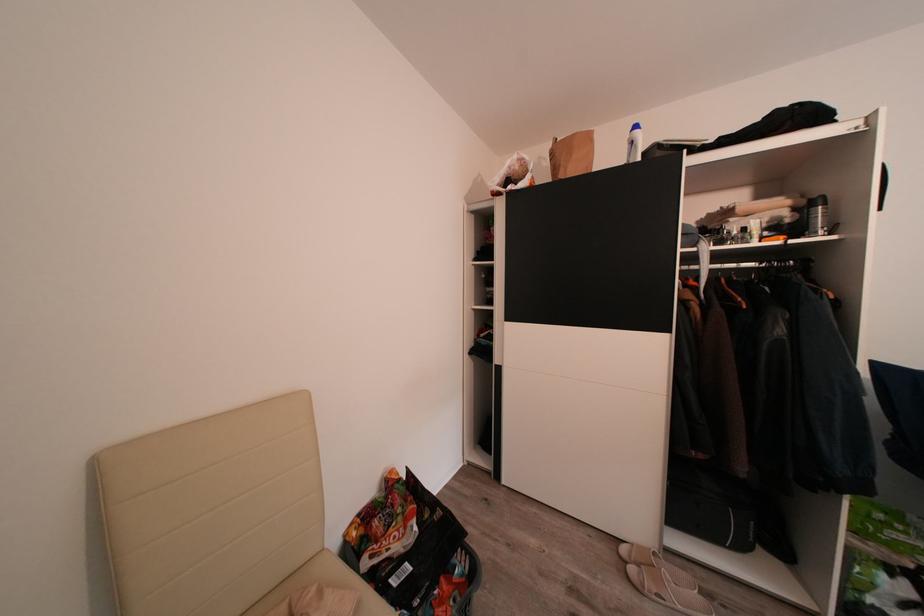
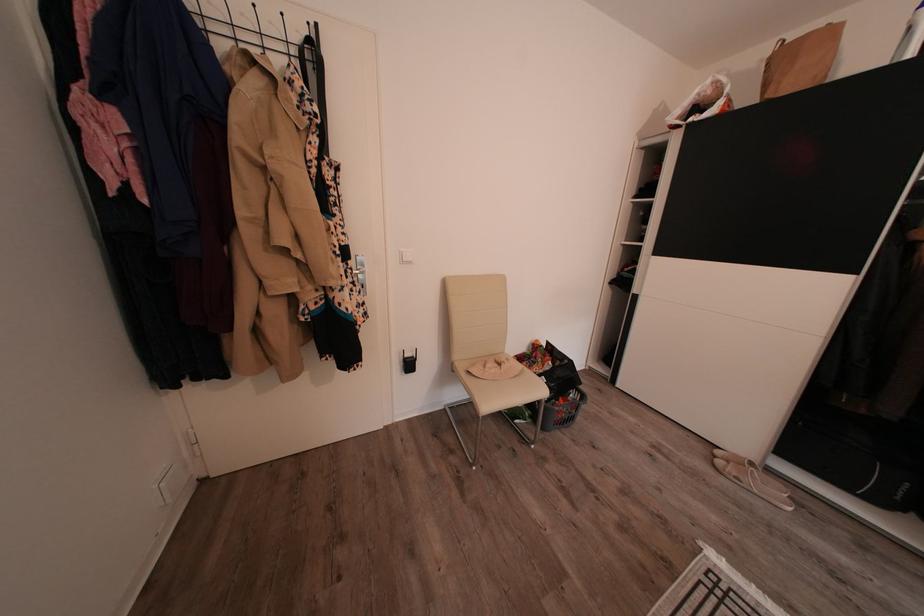
In the second image, find the point that corresponds to (x=640, y=575) in the first image.

(728, 468)